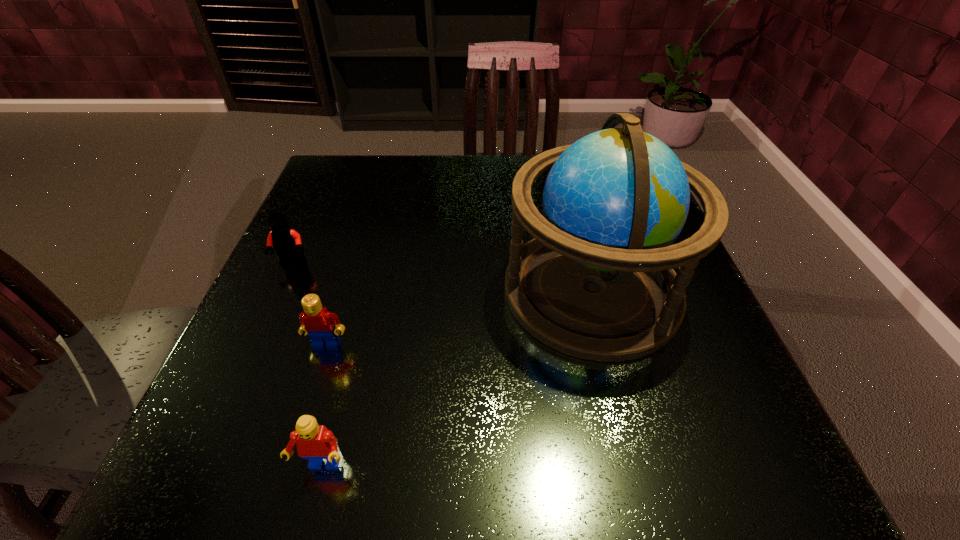
I want to click on free space between the leftmost object and the globe, so click(443, 277).

The width and height of the screenshot is (960, 540). I want to click on free point between the second nearest Lego and the globe, so click(460, 318).

The image size is (960, 540). I want to click on free space between the rightmost object and the farthest Lego, so pos(443,277).

The width and height of the screenshot is (960, 540). Find the location of `vacant area that lies between the nearest Lego and the second farthest Lego`. vacant area that lies between the nearest Lego and the second farthest Lego is located at coordinates (324, 406).

This screenshot has height=540, width=960. I want to click on object that can be found as the third closest to the leftmost object, so click(597, 282).

The width and height of the screenshot is (960, 540). Identify the location of object that ranks as the third closest to the farthest Lego. (597, 282).

Where is `Lego that can be found as the third closest to the rightmost object`? This screenshot has width=960, height=540. Lego that can be found as the third closest to the rightmost object is located at coordinates (287, 243).

This screenshot has width=960, height=540. Identify the location of Lego that can be found as the second closest to the nearest object. coord(287,243).

Image resolution: width=960 pixels, height=540 pixels. Identify the location of vacant space that satisfies the following two spatial constraints: 1. on the front-facing side of the farthest Lego; 2. on the right side of the globe. (281, 291).